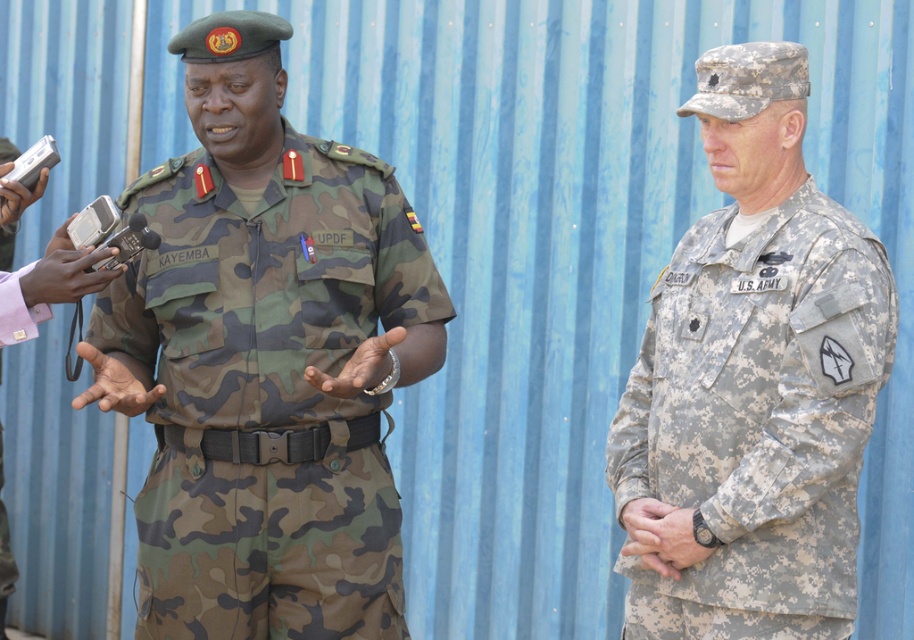
Does camo fabric uniform at center have a greater height compared to camouflage fabric us army uniform at right?

Indeed, camo fabric uniform at center has a greater height compared to camouflage fabric us army uniform at right.

Is camo fabric uniform at center bigger than camouflage fabric us army uniform at right?

Correct, camo fabric uniform at center is larger in size than camouflage fabric us army uniform at right.

Where is `camo fabric uniform at center`? The width and height of the screenshot is (914, 640). camo fabric uniform at center is located at coordinates (268, 390).